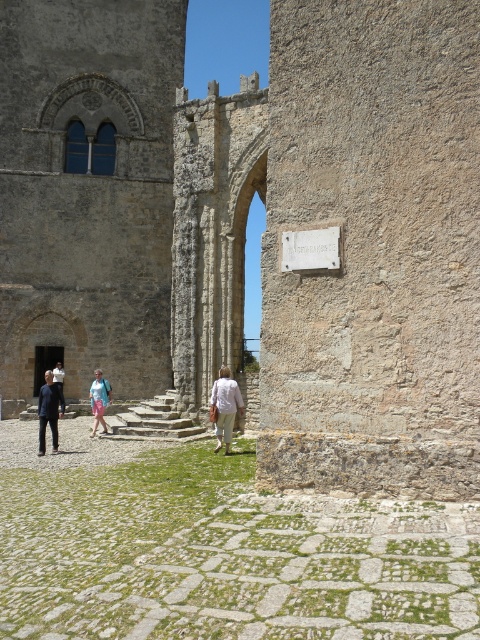
Question: Can you confirm if white stone plaque at center is positioned to the right of white cotton shirt at center?

Choices:
 (A) yes
 (B) no

Answer: (A)

Question: Observing the image, what is the correct spatial positioning of white cotton shirt at center in reference to dark blue shirt at lower left?

Choices:
 (A) above
 (B) below

Answer: (B)

Question: Estimate the real-world distances between objects in this image. Which object is farther from the light blue denim shorts at center?

Choices:
 (A) dark gray fabric pants at lower left
 (B) white stone plaque at center
 (C) white cotton shirt at center

Answer: (B)

Question: Which point is closer to the camera?

Choices:
 (A) dark gray fabric pants at lower left
 (B) light blue denim shorts at center
 (C) white stone plaque at center

Answer: (C)

Question: Does white cotton shirt at center come behind dark gray fabric pants at lower left?

Choices:
 (A) no
 (B) yes

Answer: (A)

Question: Which point is closer to the camera taking this photo?

Choices:
 (A) [61, 388]
 (B) [98, 396]
 (C) [45, 449]

Answer: (C)